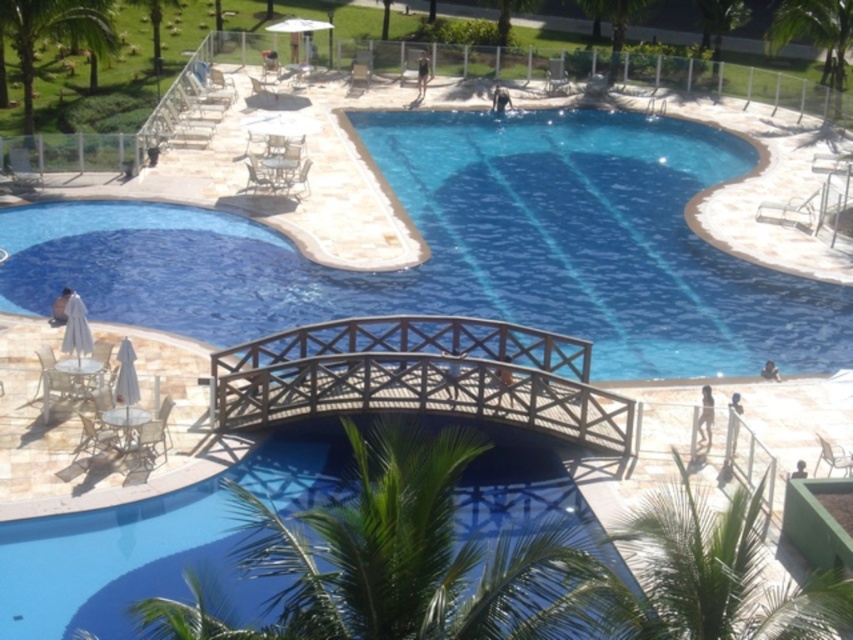
You are standing at the wooden bridge and want to take a photo of both the point at coordinates (672, 273) and the point at coordinates (587, 3) in the scene. Which point will appear larger in your photo?

The point at coordinates (672, 273) will appear larger in the photo because it is closer to the camera than the point at coordinates (587, 3).

You are standing at the entrance of the resort pool area and want to find the clear blue water at center. Based on the coordinates provided, in which direction should you look to locate it?

The clear blue water at center is located at point coordinates, so you should look towards the center area of the pool to find it.